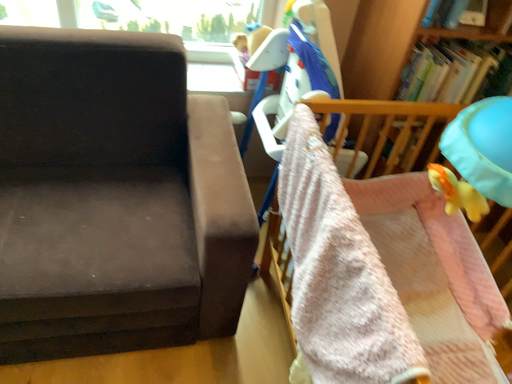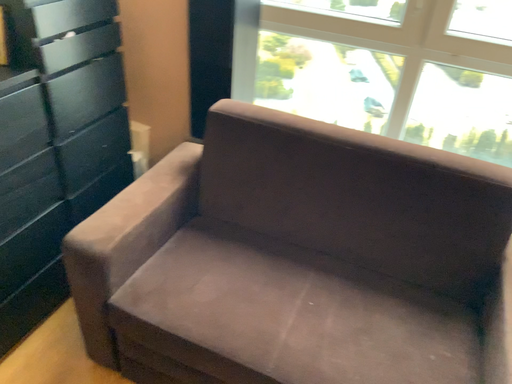
Question: Which way did the camera rotate in the video?

Choices:
 (A) rotated downward
 (B) rotated upward

Answer: (B)